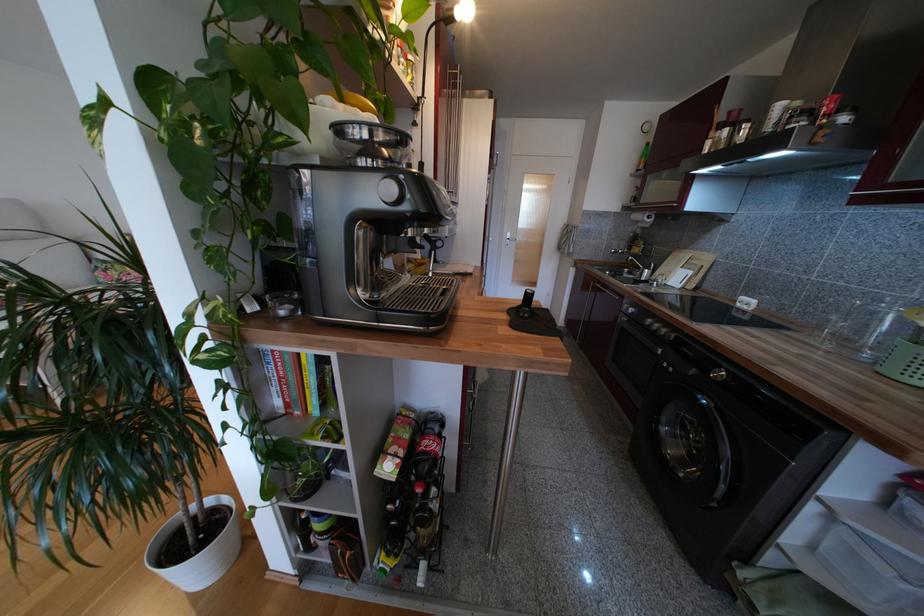
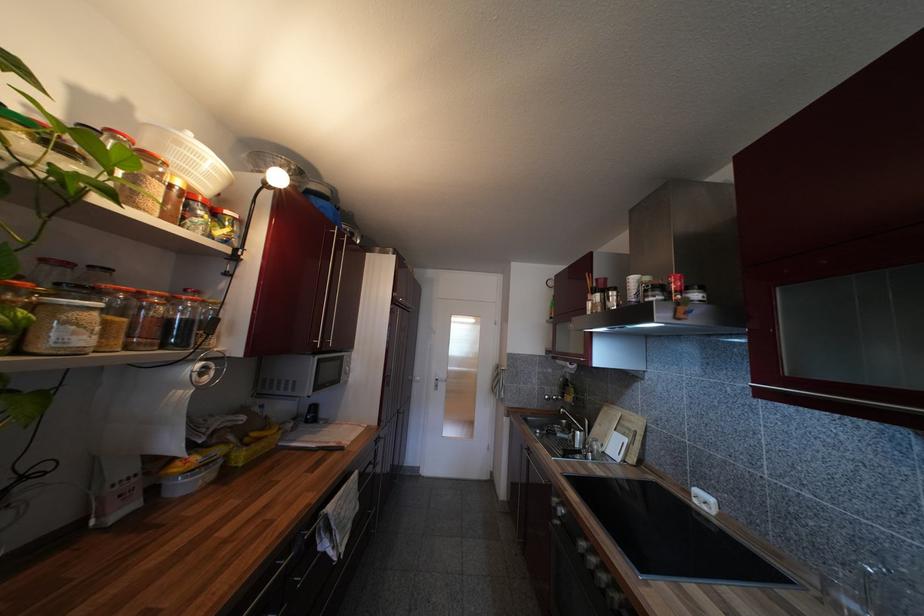
In the second image, find the point that corresponds to [667,336] in the first image.

(609, 590)